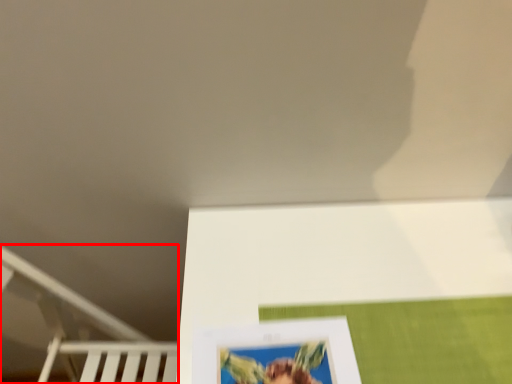
Question: Where is bunk bed (annotated by the red box) located in relation to picture frame in the image?

Choices:
 (A) left
 (B) right

Answer: (A)